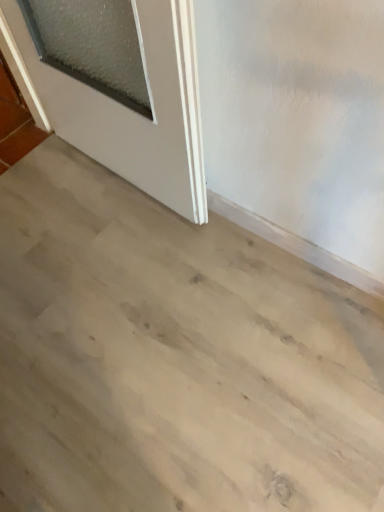
Identify the location of free space below white glossy door at upper left (from a real-world perspective). Image resolution: width=384 pixels, height=512 pixels. (123, 187).